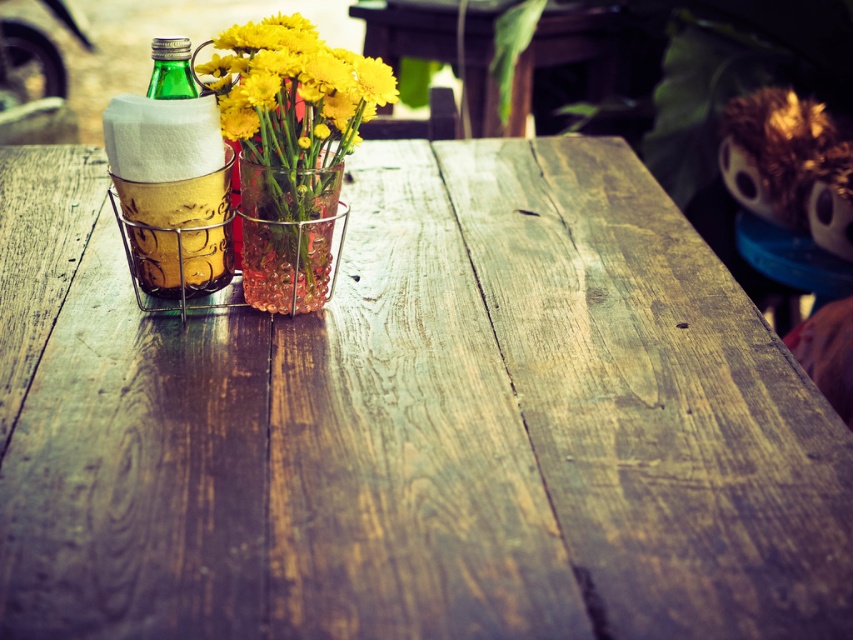
Between point (268, 96) and point (322, 218), which one is positioned in front?

Positioned in front is point (268, 96).

Does translucent glass vase at center appear under clear glass vase at center?

No.

Who is more distant from viewer, (270, 65) or (294, 259)?

Positioned behind is point (294, 259).

Locate an element on the screen. The height and width of the screenshot is (640, 853). translucent glass vase at center is located at coordinates (292, 90).

Is translucent glass vase at center thinner than green glass bottle at upper left?

No.

Can you confirm if translucent glass vase at center is positioned to the left of green glass bottle at upper left?

Incorrect, translucent glass vase at center is not on the left side of green glass bottle at upper left.

Who is more forward, (244, 54) or (184, 88)?

Point (244, 54)

At what (x,y) coordinates should I click in order to perform the action: click on translucent glass vase at center. Please return your answer as a coordinate pair (x, y). This screenshot has width=853, height=640. Looking at the image, I should click on (292, 90).

Is green glass bottle at left taller than clear glass vase at center?

Correct, green glass bottle at left is much taller as clear glass vase at center.

Between green glass bottle at left and clear glass vase at center, which one has more height?

green glass bottle at left is taller.

Describe the element at coordinates (172, 179) in the screenshot. This screenshot has height=640, width=853. I see `green glass bottle at left` at that location.

Locate an element on the screen. This screenshot has width=853, height=640. green glass bottle at left is located at coordinates (172, 179).